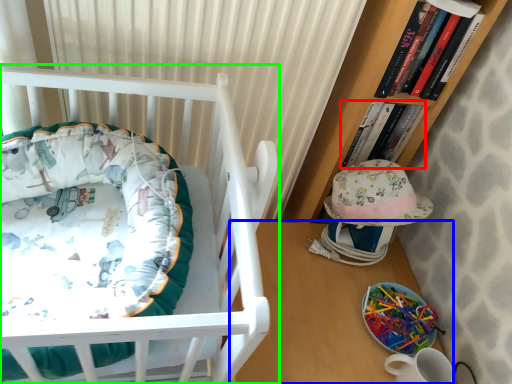
Question: Based on their relative distances, which object is nearer to book (highlighted by a red box)? Choose from table (highlighted by a blue box) and infant bed (highlighted by a green box).

Choices:
 (A) table
 (B) infant bed

Answer: (A)